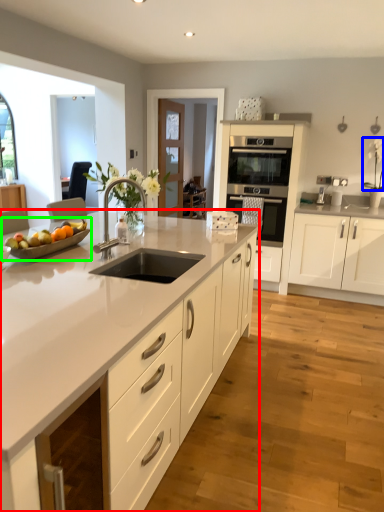
Question: Considering the real-world distances, which object is closest to cabinetry (highlighted by a red box)? flower (highlighted by a blue box) or fruit dish (highlighted by a green box).

Choices:
 (A) flower
 (B) fruit dish

Answer: (B)